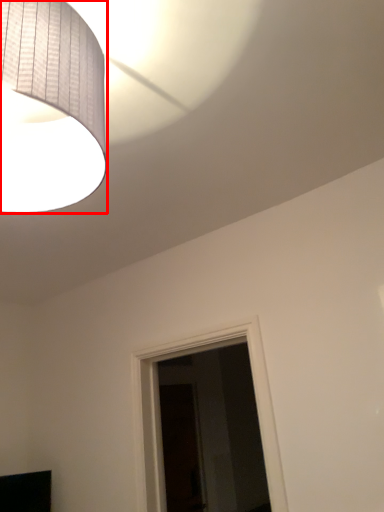
Question: In this image, where is lamp (annotated by the red box) located relative to furniture?

Choices:
 (A) right
 (B) left

Answer: (A)